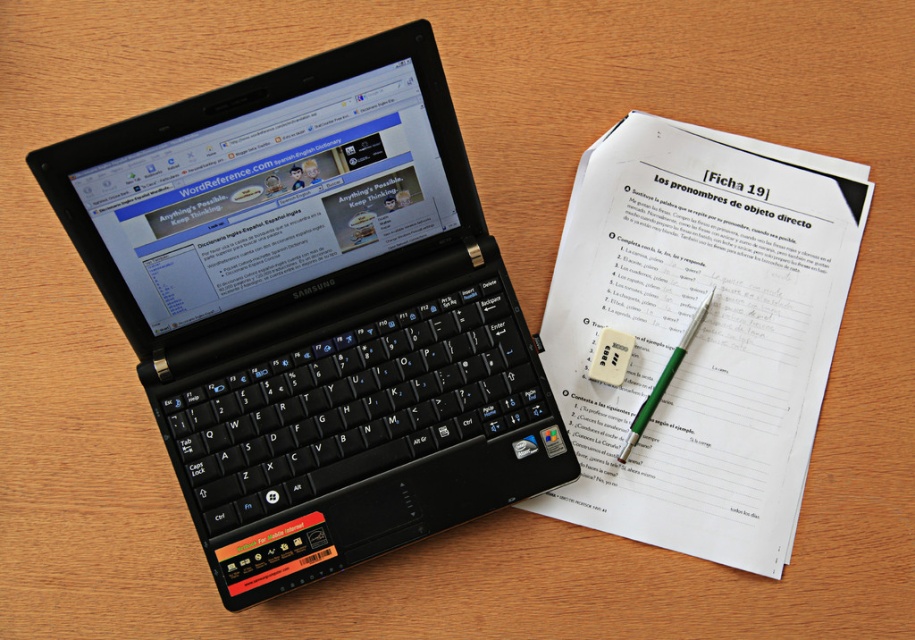
You are a student trying to write a sentence in Spanish using the worksheet. You need to reach for either the black plastic keyboard at center or the green plastic pen at upper right. Which object is closer to your hand if your hand is currently at the position of the laptop screen?

The black plastic keyboard at center is closer to your hand because it is below the green plastic pen at upper right, meaning it is positioned lower and nearer to the laptop screen area.

You are a student who needs to type an essay quickly. You have a black plastic laptop at upper left and a black plastic keyboard at center on your desk. Considering the space between them, will you have enough room to comfortably type without your hands hitting the laptop?

The distance between the black plastic laptop at upper left and the black plastic keyboard at center is 1.97 inches. This small gap may make it difficult to type comfortably as your hands might accidentally hit the laptop while typing.

You are a delivery person who needs to place a camera on the wooden surface next to the black plastic laptop at upper left. The camera requires a minimum of 28 inches of space between it and any other objects to avoid interference. Based on the current setup, can you safely place the camera there?

The black plastic laptop at upper left and camera are 27.39 inches apart from each other. Since the required minimum distance is 28 inches, the current spacing is insufficient. Therefore, placing the camera there would not be safe as it is 0.61 inches too close.